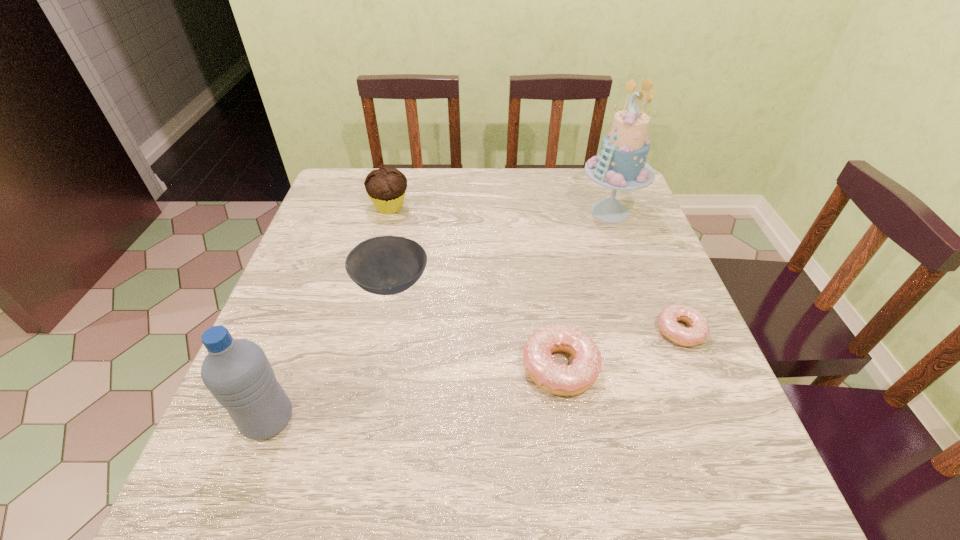
I want to click on vacant point located 0.230m on the left of the shorter doughnut, so click(547, 331).

Locate an element on the screen. The width and height of the screenshot is (960, 540). free location located 0.080m on the front of the bowl is located at coordinates (379, 343).

Where is `blank space located 0.400m with a ladder on the side of the cake`? This screenshot has width=960, height=540. blank space located 0.400m with a ladder on the side of the cake is located at coordinates (435, 212).

Where is `vacant space located 0.340m with a ladder on the side of the cake`? This screenshot has height=540, width=960. vacant space located 0.340m with a ladder on the side of the cake is located at coordinates (457, 212).

What are the coordinates of `free spot located with a ladder on the side of the cake` in the screenshot? It's located at (510, 212).

Locate an element on the screen. This screenshot has height=540, width=960. free space located on the front of the fourth shortest object is located at coordinates (361, 320).

Where is `vacant region located on the back of the water bottle`? The width and height of the screenshot is (960, 540). vacant region located on the back of the water bottle is located at coordinates (319, 283).

Locate an element on the screen. cake that is at the far edge is located at coordinates (621, 165).

Where is `muffin situated at the far edge`? The width and height of the screenshot is (960, 540). muffin situated at the far edge is located at coordinates (386, 186).

Find the location of `doughnut that is at the near edge`. doughnut that is at the near edge is located at coordinates (574, 379).